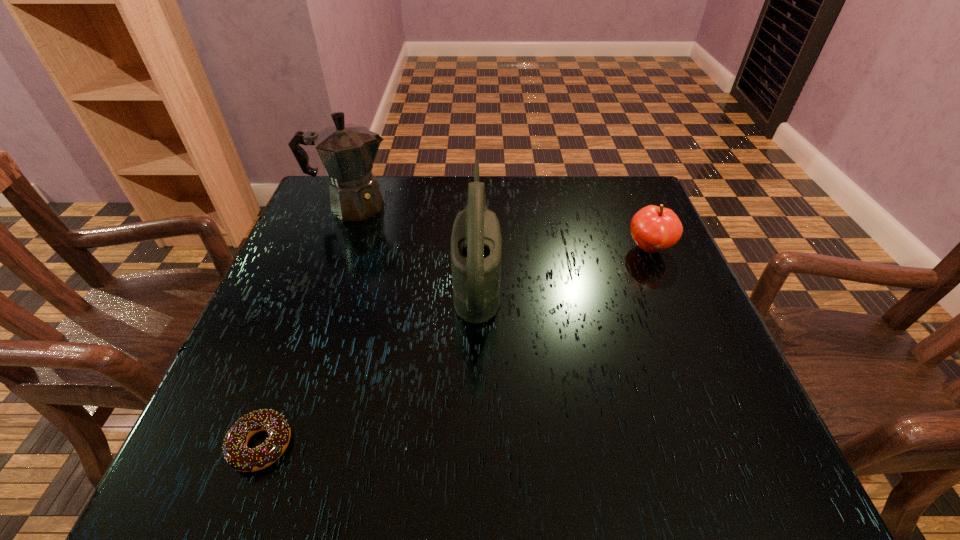
Find the location of a particular element. The width and height of the screenshot is (960, 540). coffeepot is located at coordinates (347, 151).

Image resolution: width=960 pixels, height=540 pixels. I want to click on watering can, so click(476, 243).

Identify the location of the third tallest object. This screenshot has height=540, width=960. (654, 229).

In order to click on the rightmost object in this screenshot , I will do `click(654, 229)`.

Locate an element on the screen. The image size is (960, 540). doughnut is located at coordinates (236, 453).

In order to click on the nearest object in this screenshot , I will do `click(236, 453)`.

This screenshot has height=540, width=960. I want to click on free region located 0.200m on the pouring side of the coffeepot, so click(x=470, y=206).

Locate an element on the screen. The height and width of the screenshot is (540, 960). vacant space positioned on the spout of the third object from left to right is located at coordinates (544, 276).

Image resolution: width=960 pixels, height=540 pixels. I want to click on vacant area located on the front of the rightmost object, so (x=720, y=415).

This screenshot has width=960, height=540. I want to click on vacant space located on the back of the shortest object, so click(330, 256).